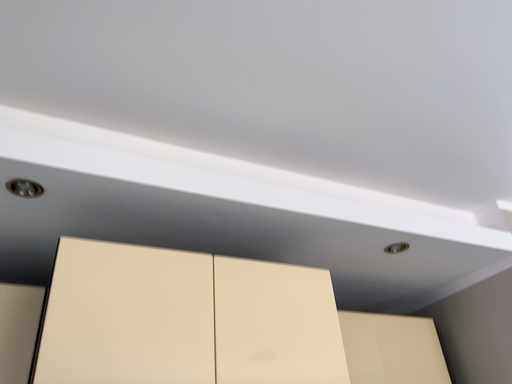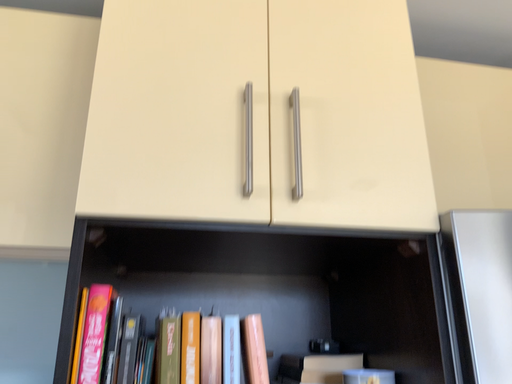
Question: How did the camera likely rotate when shooting the video?

Choices:
 (A) rotated left
 (B) rotated right

Answer: (A)